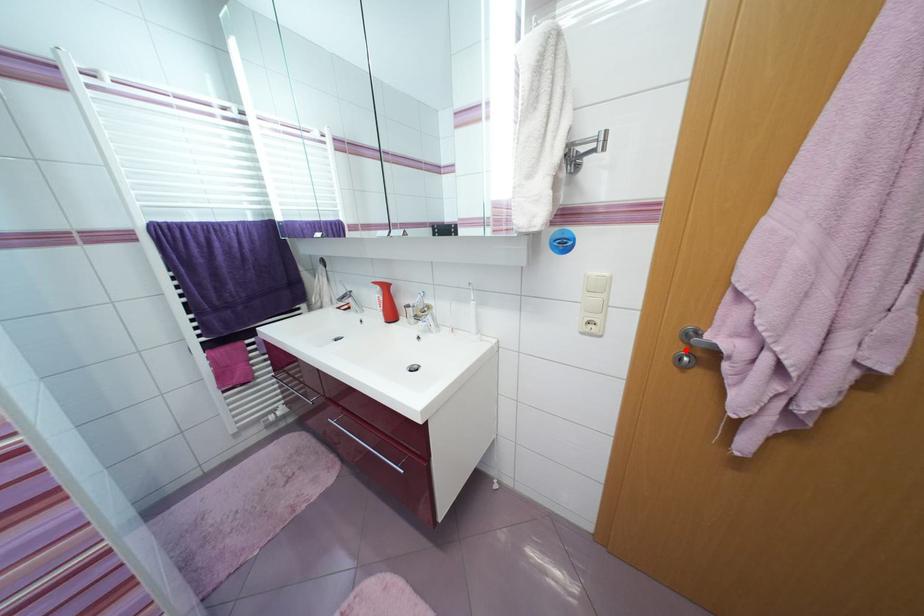
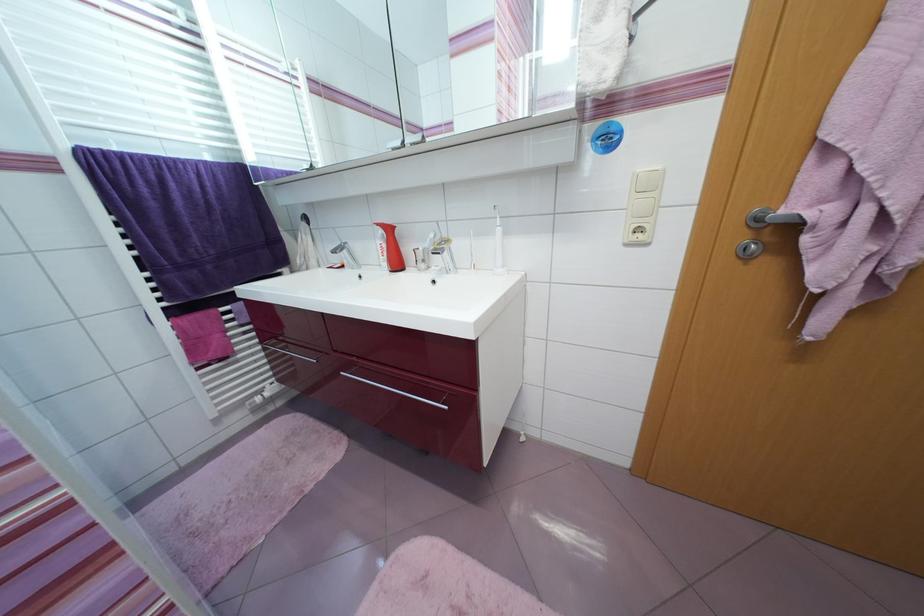
Question: I am providing you with two images of the same scene from different viewpoints. A red point is marked on the first image. At the location where the point appears in image 1, is it still visible in image 2?

Choices:
 (A) Yes
 (B) No

Answer: (A)